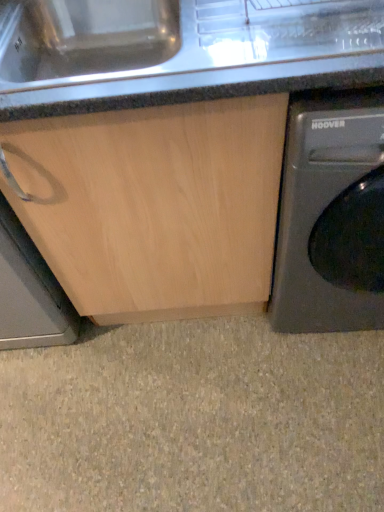
Question: Considering the positions of point (380, 177) and point (352, 374), is point (380, 177) closer or farther from the camera than point (352, 374)?

Choices:
 (A) closer
 (B) farther

Answer: (A)

Question: Considering the positions of metallic gray washing machine at right and beige wood cabinet at lower left in the image, is metallic gray washing machine at right wider or thinner than beige wood cabinet at lower left?

Choices:
 (A) thin
 (B) wide

Answer: (B)

Question: Which of these objects is positioned closest to the metallic gray washing machine at right?

Choices:
 (A) granite countertop at center
 (B) beige wood cabinet at lower left

Answer: (A)

Question: Which is farther from the metallic gray washing machine at right?

Choices:
 (A) granite countertop at center
 (B) beige wood cabinet at lower left

Answer: (B)